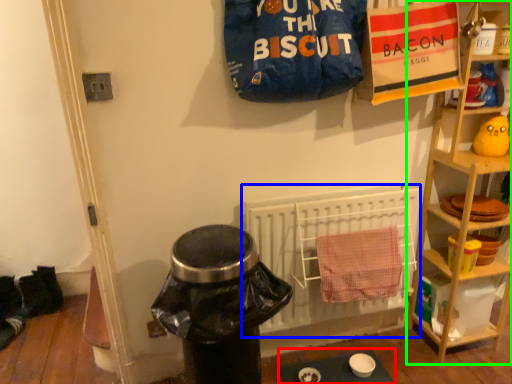
Question: Considering the real-world distances, which object is farthest from table (highlighted by a red box)? radiator (highlighted by a blue box) or shelf (highlighted by a green box)?

Choices:
 (A) radiator
 (B) shelf

Answer: (B)